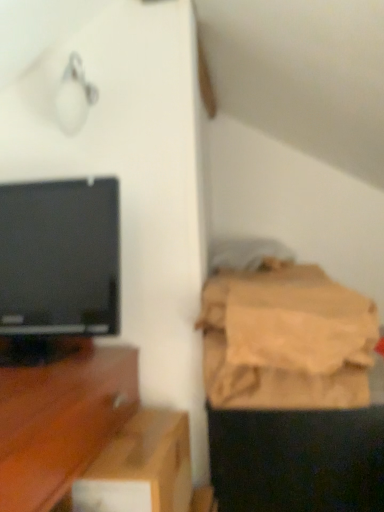
Where is `empty space that is ontop of brown cardboard box at lower center (from a real-world perspective)`? empty space that is ontop of brown cardboard box at lower center (from a real-world perspective) is located at coordinates (155, 433).